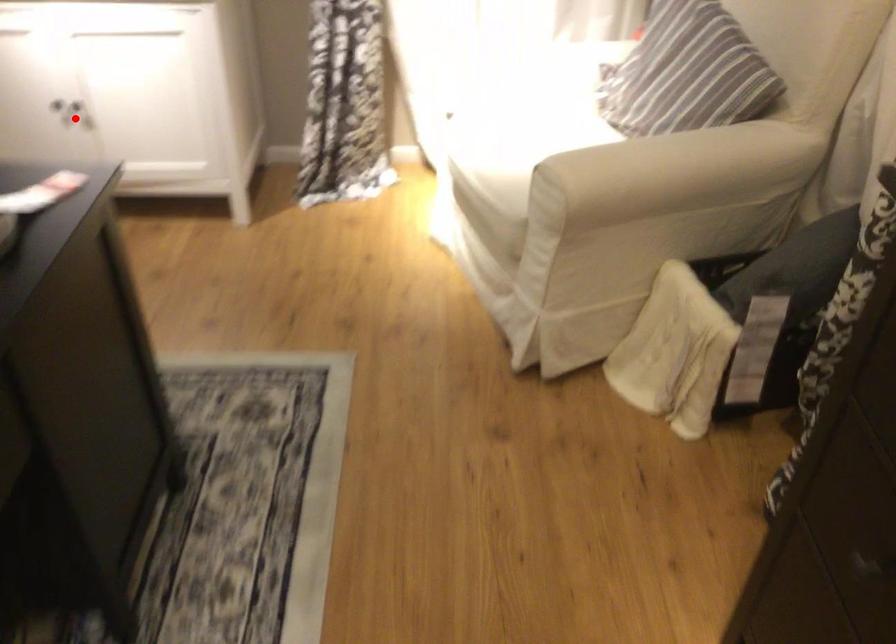
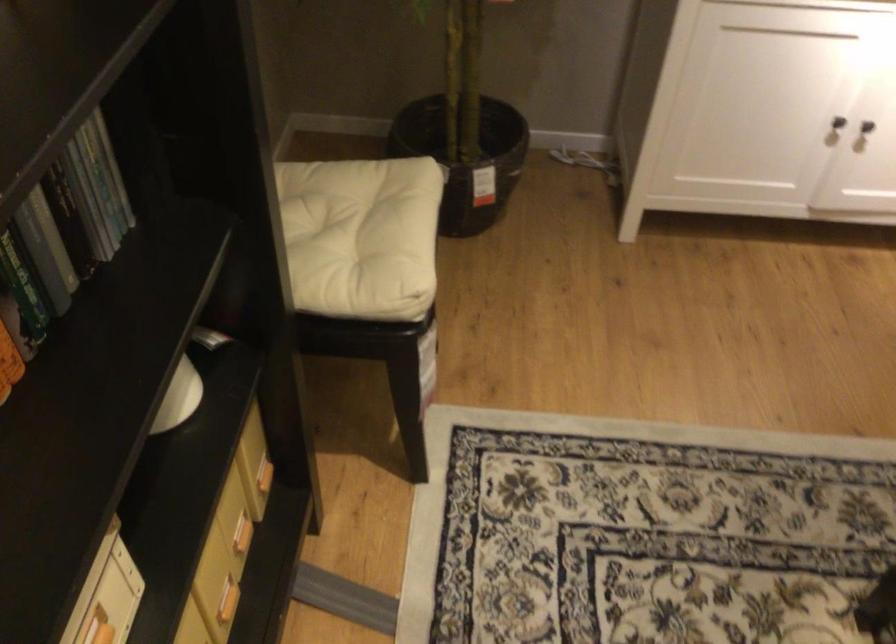
Question: I am providing you with two images of the same scene from different viewpoints. A red point is marked on the first image. Can you still see the location of the red point in image 2?

Choices:
 (A) Yes
 (B) No

Answer: (A)